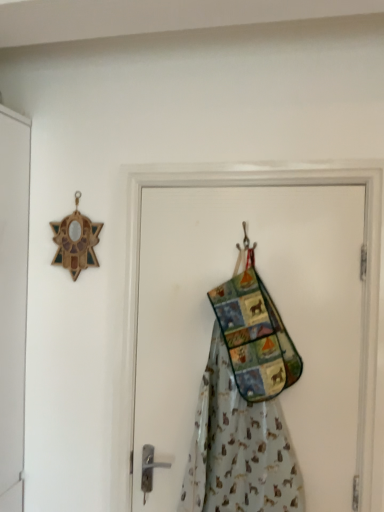
Question: Is fabric patchwork bag at center thinner than metallic hook at center?

Choices:
 (A) no
 (B) yes

Answer: (A)

Question: From a real-world perspective, is fabric patchwork bag at center over metallic hook at center?

Choices:
 (A) no
 (B) yes

Answer: (A)

Question: Is metallic hook at center completely or partially inside fabric patchwork bag at center?

Choices:
 (A) yes
 (B) no

Answer: (A)

Question: Is fabric patchwork bag at center completely or partially outside of metallic hook at center?

Choices:
 (A) no
 (B) yes

Answer: (B)

Question: From the image's perspective, does fabric patchwork bag at center appear lower than metallic hook at center?

Choices:
 (A) yes
 (B) no

Answer: (A)

Question: From a real-world perspective, is textured fabric apron at center physically located above or below metallic hook at center?

Choices:
 (A) above
 (B) below

Answer: (B)

Question: Is textured fabric apron at center spatially inside metallic hook at center, or outside of it?

Choices:
 (A) outside
 (B) inside

Answer: (A)

Question: Looking at the image, does textured fabric apron at center seem bigger or smaller compared to metallic hook at center?

Choices:
 (A) big
 (B) small

Answer: (A)

Question: From the image's perspective, is textured fabric apron at center located above or below metallic hook at center?

Choices:
 (A) above
 (B) below

Answer: (B)

Question: Looking at their shapes, would you say textured fabric apron at center is wider or thinner than fabric patchwork bag at center?

Choices:
 (A) thin
 (B) wide

Answer: (B)

Question: From a real-world perspective, is textured fabric apron at center positioned above or below fabric patchwork bag at center?

Choices:
 (A) below
 (B) above

Answer: (A)

Question: Is textured fabric apron at center spatially inside fabric patchwork bag at center, or outside of it?

Choices:
 (A) outside
 (B) inside

Answer: (A)

Question: In the image, is textured fabric apron at center on the left side or the right side of fabric patchwork bag at center?

Choices:
 (A) left
 (B) right

Answer: (A)

Question: From a real-world perspective, is metallic hook at center positioned above or below textured fabric apron at center?

Choices:
 (A) below
 (B) above

Answer: (B)

Question: Is point (243, 254) positioned closer to the camera than point (205, 487)?

Choices:
 (A) closer
 (B) farther

Answer: (B)